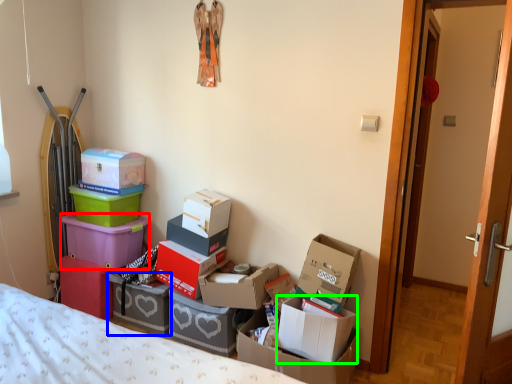
Question: Based on their relative distances, which object is farther from box (highlighted by a red box)? Choose from box (highlighted by a blue box) and box (highlighted by a green box).

Choices:
 (A) box
 (B) box

Answer: (B)